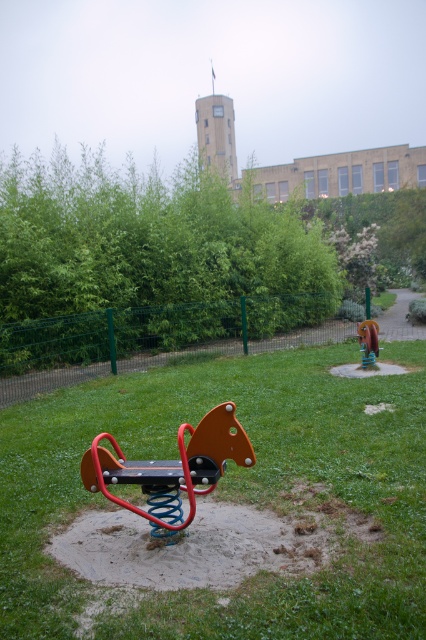
Question: Which object appears closest to the camera in this image?

Choices:
 (A) green grassy at center
 (B) wooden bench at center

Answer: (A)

Question: Is orange matte seesaw at center thinner than wooden bench at center?

Choices:
 (A) no
 (B) yes

Answer: (A)

Question: Does green grassy at center appear under wooden bench at center?

Choices:
 (A) no
 (B) yes

Answer: (B)

Question: Is green grassy at center wider than orange matte seesaw at center?

Choices:
 (A) yes
 (B) no

Answer: (A)

Question: Which point appears closest to the camera in this image?

Choices:
 (A) (376, 346)
 (B) (17, 621)
 (C) (209, 483)

Answer: (B)

Question: Which is nearer to the green grassy at center?

Choices:
 (A) wooden bench at center
 (B) orange matte seesaw at center

Answer: (B)